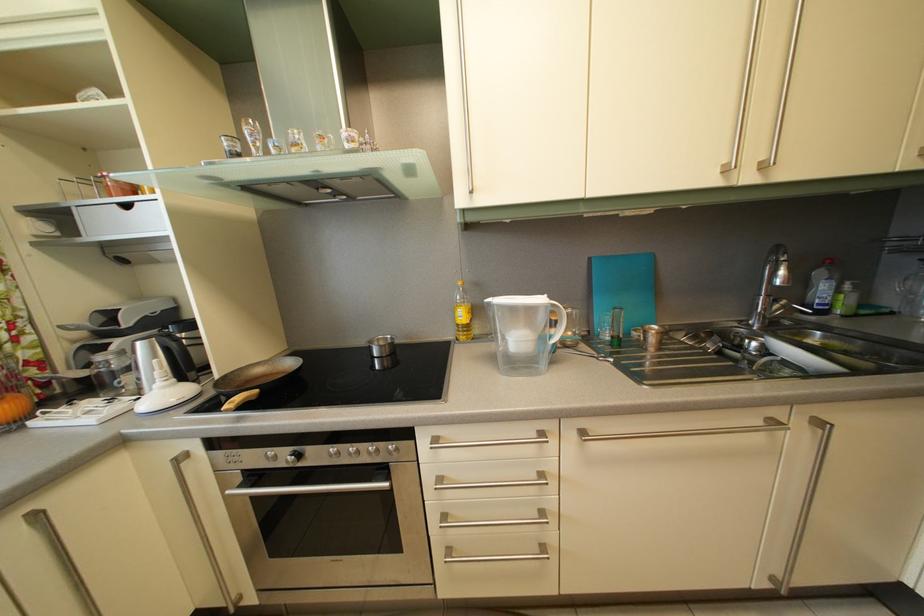
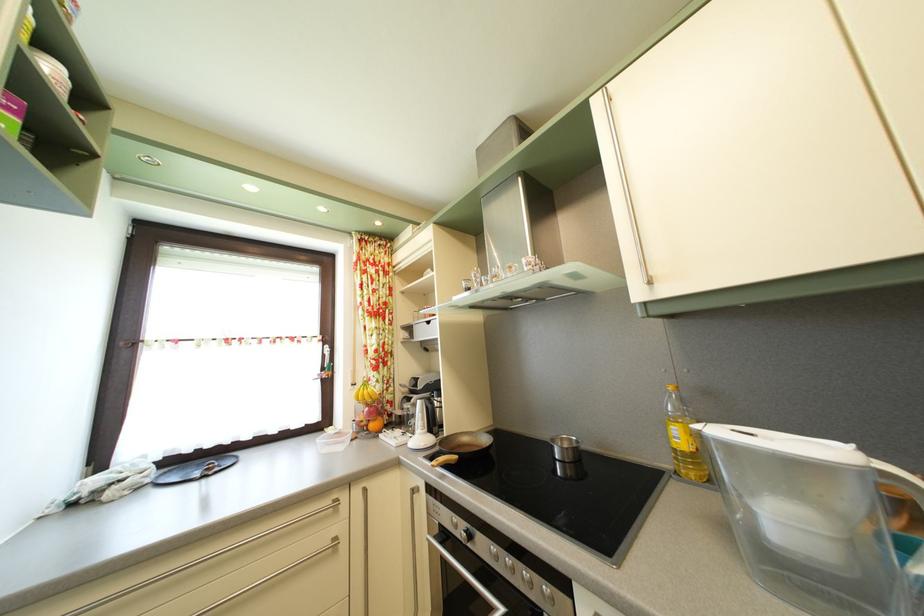
The point at (526, 347) is marked in the first image. Where is the corresponding point in the second image?

(793, 528)